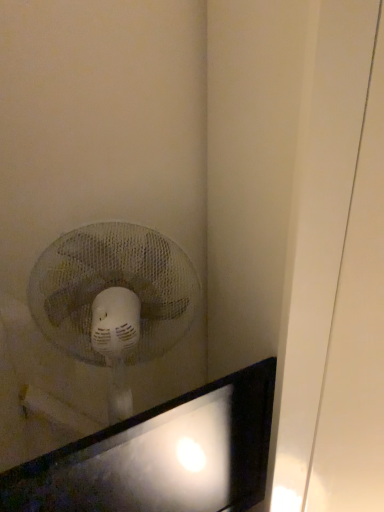
Where is `white plastic fan at upper left`? white plastic fan at upper left is located at coordinates (114, 298).

What do you see at coordinates (114, 298) in the screenshot?
I see `white plastic fan at upper left` at bounding box center [114, 298].

This screenshot has width=384, height=512. What do you see at coordinates (160, 456) in the screenshot?
I see `matte black monitor at lower left` at bounding box center [160, 456].

I want to click on matte black monitor at lower left, so click(x=160, y=456).

Measure the distance between matte black monitor at lower left and camera.

A distance of 22.23 inches exists between matte black monitor at lower left and camera.

The width and height of the screenshot is (384, 512). I want to click on white plastic fan at upper left, so click(x=114, y=298).

Visually, is matte black monitor at lower left positioned to the left or to the right of white plastic fan at upper left?

In the image, matte black monitor at lower left appears on the right side of white plastic fan at upper left.

Is the depth of matte black monitor at lower left less than that of white plastic fan at upper left?

Yes, the depth of matte black monitor at lower left is less than that of white plastic fan at upper left.

Considering the points (240, 461) and (171, 323), which point is in front, point (240, 461) or point (171, 323)?

The point (240, 461) is more forward.

From the image's perspective, which one is positioned lower, matte black monitor at lower left or white plastic fan at upper left?

matte black monitor at lower left is shown below in the image.

From a real-world perspective, which object rests below the other?

matte black monitor at lower left is physically lower.

Between matte black monitor at lower left and white plastic fan at upper left, which one has larger width?

white plastic fan at upper left is wider.

Who is shorter, matte black monitor at lower left or white plastic fan at upper left?

With less height is matte black monitor at lower left.

Who is smaller, matte black monitor at lower left or white plastic fan at upper left?

matte black monitor at lower left.

Is matte black monitor at lower left outside of white plastic fan at upper left?

Absolutely, matte black monitor at lower left is external to white plastic fan at upper left.

Is there a large distance between matte black monitor at lower left and white plastic fan at upper left?

No, matte black monitor at lower left is in close proximity to white plastic fan at upper left.

Is white plastic fan at upper left at the back of matte black monitor at lower left?

Yes, matte black monitor at lower left's orientation is away from white plastic fan at upper left.

How different are the orientations of matte black monitor at lower left and white plastic fan at upper left in degrees?

The angular difference between matte black monitor at lower left and white plastic fan at upper left is 21.6 degrees.

In order to click on computer monitor that appears below the white plastic fan at upper left (from the image's perspective) in this screenshot , I will do `click(160, 456)`.

Which is more to the right, white plastic fan at upper left or matte black monitor at lower left?

Positioned to the right is matte black monitor at lower left.

In the image, is white plastic fan at upper left positioned in front of or behind matte black monitor at lower left?

Visually, white plastic fan at upper left is located behind matte black monitor at lower left.

Considering the points (49, 334) and (54, 461), which point is behind, point (49, 334) or point (54, 461)?

The point (49, 334) is behind.

From the image's perspective, between white plastic fan at upper left and matte black monitor at lower left, which one is located above?

white plastic fan at upper left is shown above in the image.

Based on the photo, from a real-world perspective, which object stands above the other?

white plastic fan at upper left is physically above.

Considering the sizes of objects white plastic fan at upper left and matte black monitor at lower left in the image provided, who is thinner, white plastic fan at upper left or matte black monitor at lower left?

With smaller width is matte black monitor at lower left.

Consider the image. Considering the sizes of white plastic fan at upper left and matte black monitor at lower left in the image, is white plastic fan at upper left taller or shorter than matte black monitor at lower left?

Considering their sizes, white plastic fan at upper left has more height than matte black monitor at lower left.

Is white plastic fan at upper left bigger or smaller than matte black monitor at lower left?

Considering their sizes, white plastic fan at upper left takes up more space than matte black monitor at lower left.

Is matte black monitor at lower left completely or partially inside white plastic fan at upper left?

No, matte black monitor at lower left is located outside of white plastic fan at upper left.

Is white plastic fan at upper left touching matte black monitor at lower left?

No, white plastic fan at upper left is not touching matte black monitor at lower left.

Could you tell me if white plastic fan at upper left is facing matte black monitor at lower left?

Yes, white plastic fan at upper left is turned towards matte black monitor at lower left.

How many degrees apart are the facing directions of white plastic fan at upper left and matte black monitor at lower left?

21.6 degrees separate the facing orientations of white plastic fan at upper left and matte black monitor at lower left.

What are the coordinates of `mechanical fan to the left of matte black monitor at lower left` in the screenshot? It's located at (114, 298).

The height and width of the screenshot is (512, 384). What are the coordinates of `computer monitor that appears below the white plastic fan at upper left (from a real-world perspective)` in the screenshot? It's located at (160, 456).

Where is `mechanical fan that appears above the matte black monitor at lower left (from the image's perspective)`? mechanical fan that appears above the matte black monitor at lower left (from the image's perspective) is located at coordinates (114, 298).